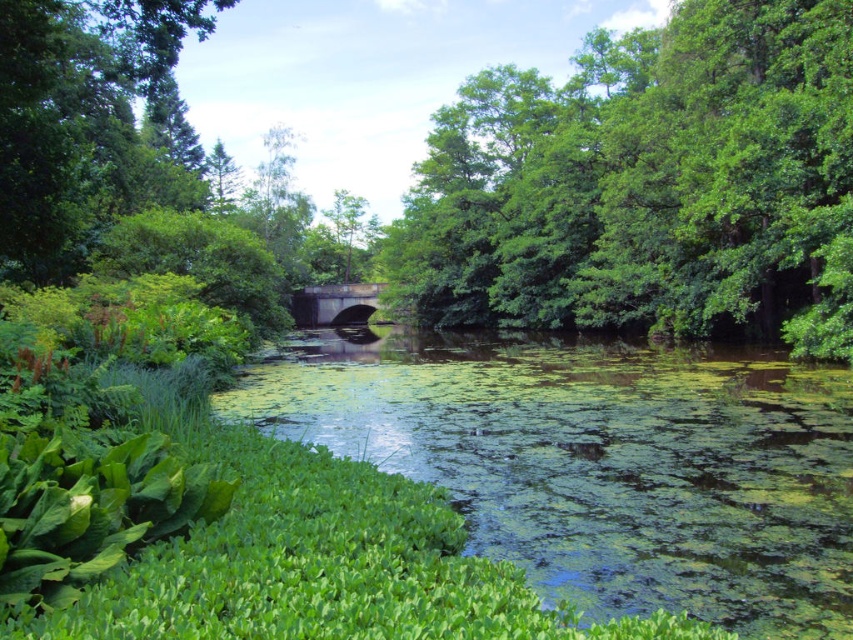
Which of these two, green algae-covered water at center or green leafy tree at upper center, stands shorter?

With less height is green algae-covered water at center.

Is green algae-covered water at center to the left of green leafy tree at upper center from the viewer's perspective?

Yes, green algae-covered water at center is to the left of green leafy tree at upper center.

Is point (405, 408) positioned before point (792, 209)?

Yes, it is.

This screenshot has height=640, width=853. In order to click on green algae-covered water at center in this screenshot , I will do `click(598, 461)`.

Is concrete bridge at center positioned behind green leafy tree at center?

No.

Is concrete bridge at center above green leafy tree at center?

Actually, concrete bridge at center is below green leafy tree at center.

Which is behind, point (341, 317) or point (374, 240)?

Point (374, 240)

Find the location of a particular element. This screenshot has width=853, height=640. concrete bridge at center is located at coordinates pos(335,304).

Which is more to the left, green algae-covered water at center or concrete bridge at center?

concrete bridge at center is more to the left.

Measure the distance from green algae-covered water at center to concrete bridge at center.

green algae-covered water at center is 201.28 feet from concrete bridge at center.

At what (x,y) coordinates should I click in order to perform the action: click on green algae-covered water at center. Please return your answer as a coordinate pair (x, y). This screenshot has height=640, width=853. Looking at the image, I should click on (598, 461).